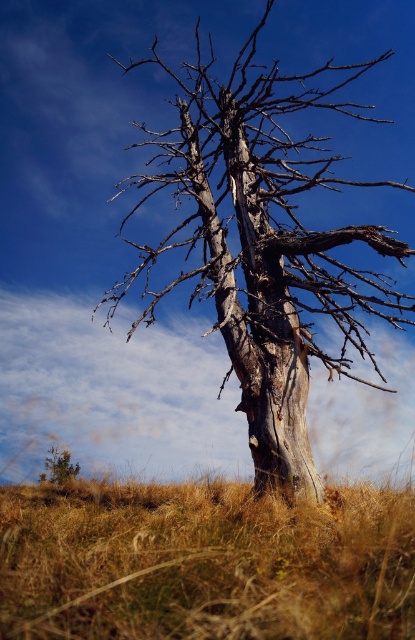
You are standing at the base of the solitary dead tree in the grassy field. You want to place a small decorative stone exactly at the point marked by coordinates point (205, 563). Based on the scene description, will the stone be placed on dry grass or on the dead tree?

The point (205, 563) marks dry grass at lower center, so placing the stone there would place it on the dry grass, not the dead tree.

You are a photographer trying to capture the gray textured tree at center from a low angle. To do this, you need to kneel on the ground. Will the dry grass at lower center interfere with your kneeling position?

The dry grass at lower center is located below the gray textured tree at center, so kneeling there would place you directly beneath the tree. The dry grass at lower center may interfere with your kneeling position as it is positioned where you would need to kneel to capture the tree from a low angle.

You are planning to place a small garden statue that is 1 meter wide between the gray textured tree at center and the brown textured bush at lower left. Based on their widths, will the statue fit between them without overlapping either?

The gray textured tree at center is wider than the brown textured bush at lower left. Since the statue is 1 meter wide, we need to know the exact widths of both objects to determine if the space between them can accommodate the statue. However, the information provided only states that the tree is wider than the bush, but does not specify their exact measurements. Therefore, it is impossible to definitively answer whether the statue will fit without additional data.